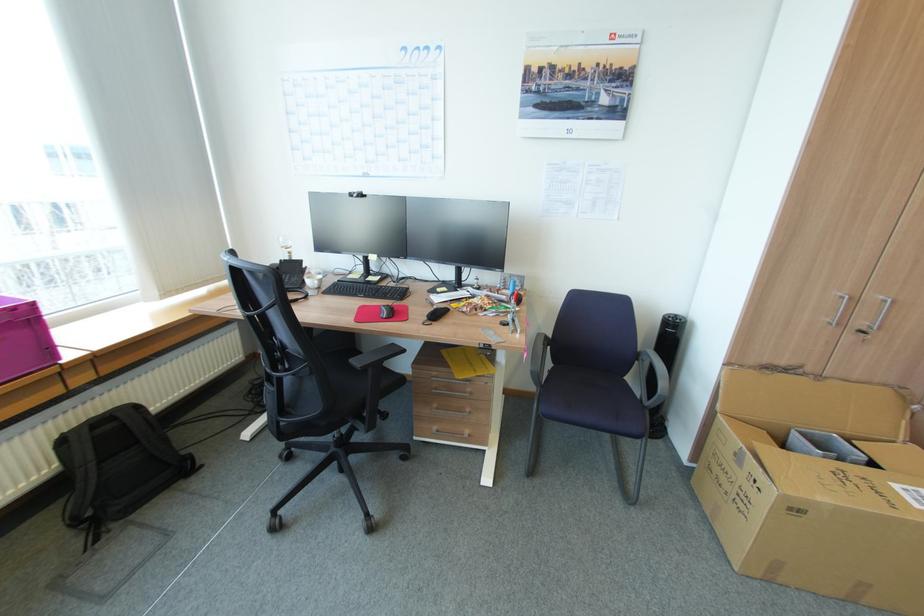
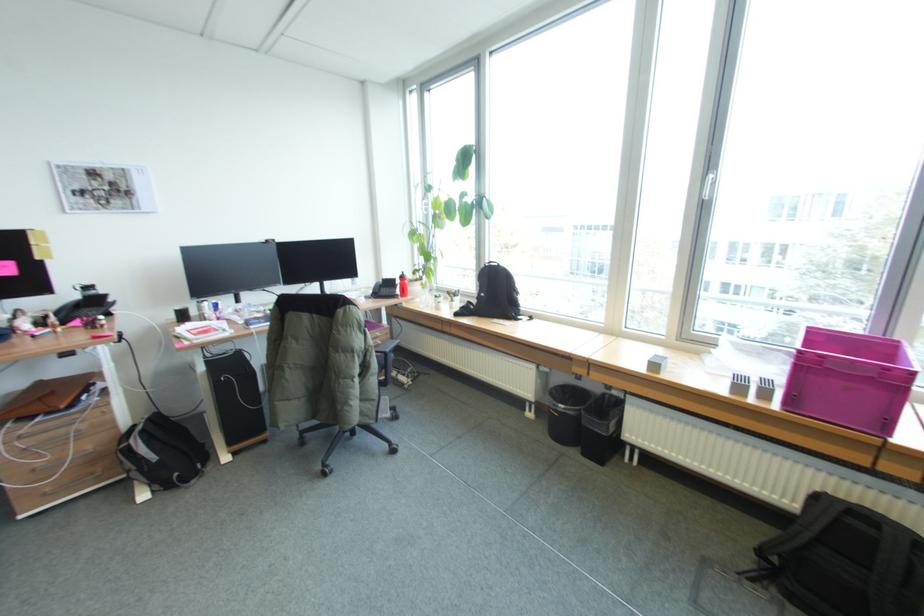
Find the pixel in the second image that matches (x=118, y=525) in the first image.

(781, 593)